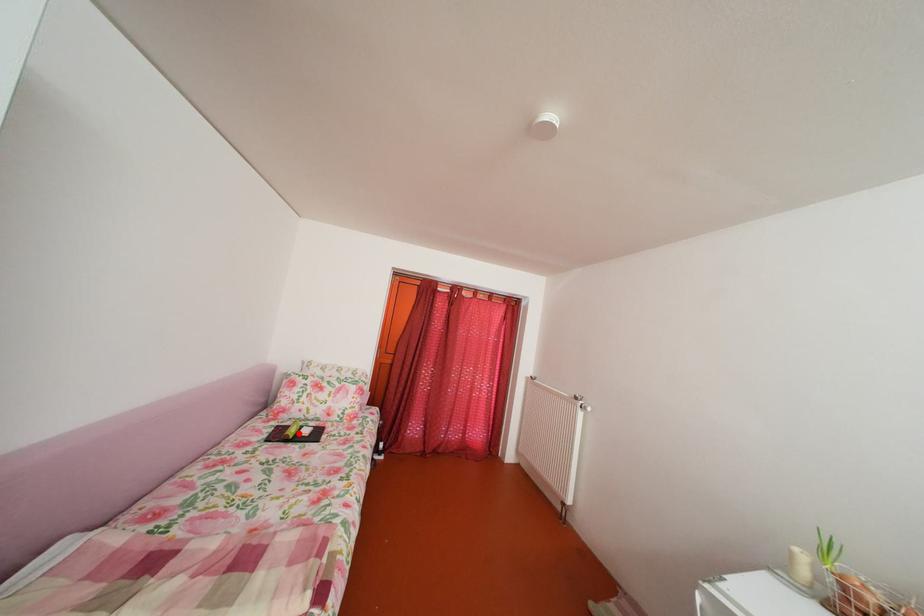
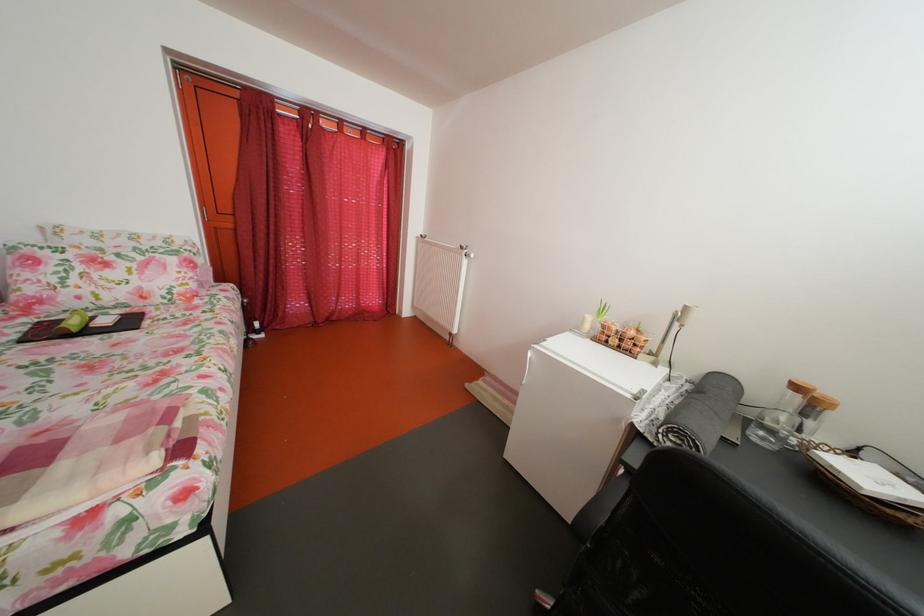
Find the pixel in the second image that matches the highlighted location in the first image.

(73, 326)